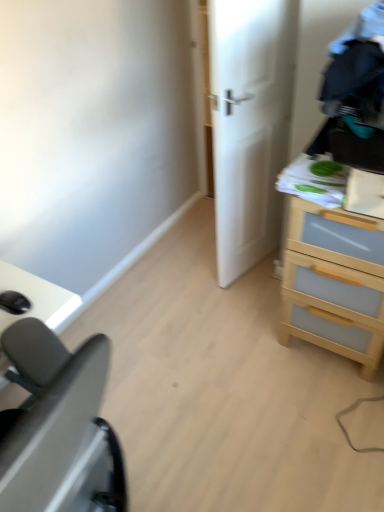
Where is `vacant area that lies in front of light wood chest of drawers at right`? The width and height of the screenshot is (384, 512). vacant area that lies in front of light wood chest of drawers at right is located at coordinates (333, 414).